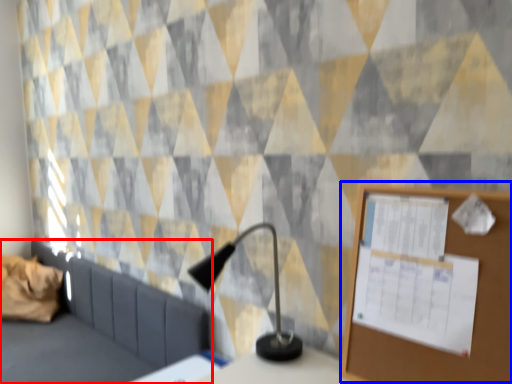
Question: Which object appears farthest to the camera in this image, furniture (highlighted by a red box) or bulletin board (highlighted by a blue box)?

Choices:
 (A) furniture
 (B) bulletin board

Answer: (A)